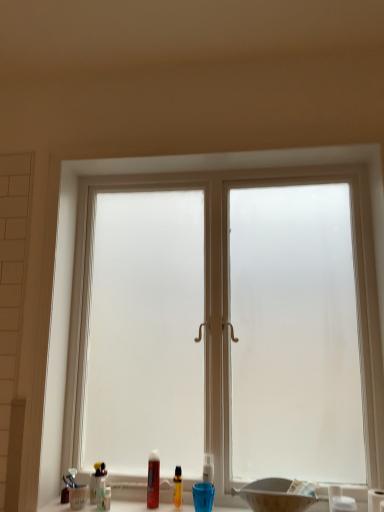
Identify the location of translucent plastic bottle at lower center, positioned as the second toiletry in back-to-front order. (177, 487).

The image size is (384, 512). What do you see at coordinates (128, 506) in the screenshot?
I see `translucent plastic bottles at lower center` at bounding box center [128, 506].

What do you see at coordinates (228, 290) in the screenshot?
I see `frosted glass window at center` at bounding box center [228, 290].

Find the location of a particular element. Image resolution: width=384 pixels, height=512 pixels. matte black basin at lower center is located at coordinates (273, 496).

You are a GUI agent. You are given a task and a screenshot of the screen. Output one action in this format:
    pyautogui.click(x=<x>, y=<y>)
    Task: Click on the white matte toilet paper at right
    
    Given the screenshot: What is the action you would take?
    [x=375, y=499]

Image resolution: width=384 pixels, height=512 pixels. Describe the element at coordinates (153, 479) in the screenshot. I see `translucent plastic bottle at center, arranged as the fourth toiletry when viewed from the front` at that location.

Where is `translucent plastic toothbrush at lower center, which is the third toiletry in back-to-front order`? This screenshot has height=512, width=384. translucent plastic toothbrush at lower center, which is the third toiletry in back-to-front order is located at coordinates (107, 498).

Where is `counter top on the left of translucent plastic bottle at lower center, the 3th toiletry from the left`? This screenshot has width=384, height=512. counter top on the left of translucent plastic bottle at lower center, the 3th toiletry from the left is located at coordinates (128, 506).

Can translucent plastic bottle at lower center, which appears as the 2th toiletry when viewed from the right, be found inside translucent plastic bottles at lower center?

No, translucent plastic bottle at lower center, which appears as the 2th toiletry when viewed from the right, is not inside translucent plastic bottles at lower center.

Is translucent plastic bottles at lower center positioned behind translucent plastic bottle at lower center, the 3th toiletry from the left?

No, translucent plastic bottles at lower center is closer to the camera.

Is translucent plastic bottles at lower center bigger or smaller than translucent plastic bottle at lower center, which appears as the 2th toiletry when viewed from the right?

translucent plastic bottles at lower center is bigger than translucent plastic bottle at lower center, which appears as the 2th toiletry when viewed from the right.

Can matte black basin at lower center be found inside translucent plastic toothbrush at lower center, marked as the 4th toiletry in a right-to-left arrangement?

Actually, matte black basin at lower center is outside translucent plastic toothbrush at lower center, marked as the 4th toiletry in a right-to-left arrangement.

Can you confirm if translucent plastic toothbrush at lower center, which is the third toiletry in back-to-front order, is positioned to the right of matte black basin at lower center?

In fact, translucent plastic toothbrush at lower center, which is the third toiletry in back-to-front order, is to the left of matte black basin at lower center.

Does point (108, 493) appear closer or farther from the camera than point (279, 506)?

Point (108, 493) is farther from the camera than point (279, 506).

Who is smaller, translucent plastic toothbrush at lower center, which is the third toiletry in back-to-front order, or matte black basin at lower center?

translucent plastic toothbrush at lower center, which is the third toiletry in back-to-front order.

In the scene shown: Is translucent plastic bottle at lower center, which appears as the 2th toiletry when viewed from the right, oriented away from translucent plastic toothbrush at lower center, which is the third toiletry in back-to-front order?

No, translucent plastic bottle at lower center, which appears as the 2th toiletry when viewed from the right, is not facing the opposite direction of translucent plastic toothbrush at lower center, which is the third toiletry in back-to-front order.

Consider the image. From the image's perspective, between translucent plastic bottle at lower center, which appears as the 2th toiletry when viewed from the right, and translucent plastic toothbrush at lower center, positioned as the first toiletry in left-to-right order, who is located below?

From the image's view, translucent plastic toothbrush at lower center, positioned as the first toiletry in left-to-right order, is below.

Considering their positions, is translucent plastic bottle at lower center, positioned as the second toiletry in back-to-front order, located in front of or behind translucent plastic toothbrush at lower center, marked as the 4th toiletry in a right-to-left arrangement?

Clearly, translucent plastic bottle at lower center, positioned as the second toiletry in back-to-front order, is behind translucent plastic toothbrush at lower center, marked as the 4th toiletry in a right-to-left arrangement.

Would you say translucent plastic bottle at lower center, which appears as the 2th toiletry when viewed from the right, is inside or outside translucent plastic toothbrush at lower center, positioned as the second toiletry in front-to-back order?

translucent plastic bottle at lower center, which appears as the 2th toiletry when viewed from the right, is outside translucent plastic toothbrush at lower center, positioned as the second toiletry in front-to-back order.

Identify the location of basin lying above the translucent plastic bottle at lower center, placed as the 3th toiletry when sorted from front to back (from the image's perspective). (273, 496).

Between matte black basin at lower center and translucent plastic bottle at lower center, the 3th toiletry from the left, which one appears on the right side from the viewer's perspective?

matte black basin at lower center is more to the right.

From the image's perspective, who appears lower, matte black basin at lower center or translucent plastic bottle at lower center, placed as the 3th toiletry when sorted from front to back?

translucent plastic bottle at lower center, placed as the 3th toiletry when sorted from front to back, appears lower in the image.

Is matte black basin at lower center looking in the opposite direction of translucent plastic bottle at lower center, placed as the 3th toiletry when sorted from front to back?

matte black basin at lower center does not have its back to translucent plastic bottle at lower center, placed as the 3th toiletry when sorted from front to back.

Is matte black basin at lower center looking in the opposite direction of white matte toilet paper at right?

matte black basin at lower center is not turned away from white matte toilet paper at right.

Which is correct: matte black basin at lower center is inside white matte toilet paper at right, or outside of it?

matte black basin at lower center exists outside the volume of white matte toilet paper at right.

Is the depth of matte black basin at lower center less than that of white matte toilet paper at right?

Yes.

From a real-world perspective, is matte black basin at lower center positioned above or below white matte toilet paper at right?

Clearly, from a real-world perspective, matte black basin at lower center is above white matte toilet paper at right.

From the image's perspective, is white plastic toothbrush at lower center, which is counted as the fourth toiletry, starting from the left, above or below translucent plastic bottle at lower center, positioned as the second toiletry in back-to-front order?

white plastic toothbrush at lower center, which is counted as the fourth toiletry, starting from the left, is below translucent plastic bottle at lower center, positioned as the second toiletry in back-to-front order.

In the image, is white plastic toothbrush at lower center, which is counted as the fourth toiletry, starting from the left, positioned in front of or behind translucent plastic bottle at lower center, placed as the 3th toiletry when sorted from front to back?

white plastic toothbrush at lower center, which is counted as the fourth toiletry, starting from the left, is positioned closer to the viewer than translucent plastic bottle at lower center, placed as the 3th toiletry when sorted from front to back.

Between white plastic toothbrush at lower center, which is counted as the fourth toiletry, starting from the left, and translucent plastic bottle at lower center, which appears as the 2th toiletry when viewed from the right, which one has more height?

Standing taller between the two is translucent plastic bottle at lower center, which appears as the 2th toiletry when viewed from the right.

Is white plastic toothbrush at lower center, which is the 1th toiletry from front to back, completely or partially outside of translucent plastic bottle at lower center, the 3th toiletry from the left?

Indeed, white plastic toothbrush at lower center, which is the 1th toiletry from front to back, is completely outside translucent plastic bottle at lower center, the 3th toiletry from the left.

Between translucent plastic bottle at center, the 1th toiletry when ordered from back to front, and white matte toilet paper at right, which one has smaller size?

translucent plastic bottle at center, the 1th toiletry when ordered from back to front.

From a real-world perspective, which is physically below, translucent plastic bottle at center, the 1th toiletry when ordered from back to front, or white matte toilet paper at right?

In real-world perspective, white matte toilet paper at right is lower.

From the image's perspective, starting from the white matte toilet paper at right, which toiletry is the 2nd one above? Please provide its 2D coordinates.

[(153, 479)]

Considering the positions of objects translucent plastic bottle at center, the 1th toiletry when ordered from back to front, and white matte toilet paper at right in the image provided, who is more to the right, translucent plastic bottle at center, the 1th toiletry when ordered from back to front, or white matte toilet paper at right?

white matte toilet paper at right is more to the right.

Where is `counter top below the translucent plastic bottle at lower center, positioned as the second toiletry in back-to-front order (from a real-world perspective)`? counter top below the translucent plastic bottle at lower center, positioned as the second toiletry in back-to-front order (from a real-world perspective) is located at coordinates (128, 506).

Starting from the matte black basin at lower center, which toiletry is the 3rd one to the left? Please provide its 2D coordinates.

[(107, 498)]

Based on their spatial positions, is frosted glass window at center or white matte toilet paper at right closer to translucent plastic bottle at lower center, the 3th toiletry from the left?

white matte toilet paper at right.

Looking at the image, which one is located closer to white matte toilet paper at right, translucent plastic bottle at center, the 1th toiletry when ordered from back to front, or matte black basin at lower center?

matte black basin at lower center is positioned closer to the anchor white matte toilet paper at right.

When comparing their distances from white plastic toothbrush at lower center, which is the fourth toiletry in back-to-front order, does white matte toilet paper at right or matte black basin at lower center seem closer?

The object closer to white plastic toothbrush at lower center, which is the fourth toiletry in back-to-front order, is white matte toilet paper at right.

Estimate the real-world distances between objects in this image. Which object is further from translucent plastic bottle at lower center, which appears as the 2th toiletry when viewed from the right, frosted glass window at center or translucent plastic toothbrush at lower center, which is the third toiletry in back-to-front order?

frosted glass window at center is positioned further to the anchor translucent plastic bottle at lower center, which appears as the 2th toiletry when viewed from the right.

Estimate the real-world distances between objects in this image. Which object is closer to matte black basin at lower center, translucent plastic bottles at lower center or translucent plastic bottle at center, the second toiletry when ordered from left to right?

Among the two, translucent plastic bottles at lower center is located nearer to matte black basin at lower center.

Based on their spatial positions, is translucent plastic bottle at center, which ranks as the 3th toiletry in right-to-left order, or white matte toilet paper at right closer to frosted glass window at center?

translucent plastic bottle at center, which ranks as the 3th toiletry in right-to-left order, is positioned closer to the anchor frosted glass window at center.

Estimate the real-world distances between objects in this image. Which object is closer to white matte toilet paper at right, translucent plastic bottle at lower center, positioned as the second toiletry in back-to-front order, or matte black basin at lower center?

matte black basin at lower center is positioned closer to the anchor white matte toilet paper at right.

From the picture: Estimate the real-world distances between objects in this image. Which object is further from white matte toilet paper at right, translucent plastic toothbrush at lower center, which is the third toiletry in back-to-front order, or matte black basin at lower center?

translucent plastic toothbrush at lower center, which is the third toiletry in back-to-front order, is positioned further to the anchor white matte toilet paper at right.

Where is `toiletry located between translucent plastic bottle at lower center, positioned as the second toiletry in back-to-front order, and white matte toilet paper at right in the left-right direction`? Image resolution: width=384 pixels, height=512 pixels. toiletry located between translucent plastic bottle at lower center, positioned as the second toiletry in back-to-front order, and white matte toilet paper at right in the left-right direction is located at coordinates (343, 504).

Where is `basin between translucent plastic toothbrush at lower center, positioned as the second toiletry in front-to-back order, and white plastic toothbrush at lower center, which is counted as the fourth toiletry, starting from the left, in the horizontal direction`? basin between translucent plastic toothbrush at lower center, positioned as the second toiletry in front-to-back order, and white plastic toothbrush at lower center, which is counted as the fourth toiletry, starting from the left, in the horizontal direction is located at coordinates (273, 496).

I want to click on toiletry between translucent plastic bottles at lower center and white plastic toothbrush at lower center, which is the fourth toiletry in back-to-front order, in the horizontal direction, so click(177, 487).

The height and width of the screenshot is (512, 384). Identify the location of counter top located between translucent plastic toothbrush at lower center, positioned as the first toiletry in left-to-right order, and translucent plastic bottle at lower center, which appears as the 2th toiletry when viewed from the right, in the left-right direction. (128, 506).